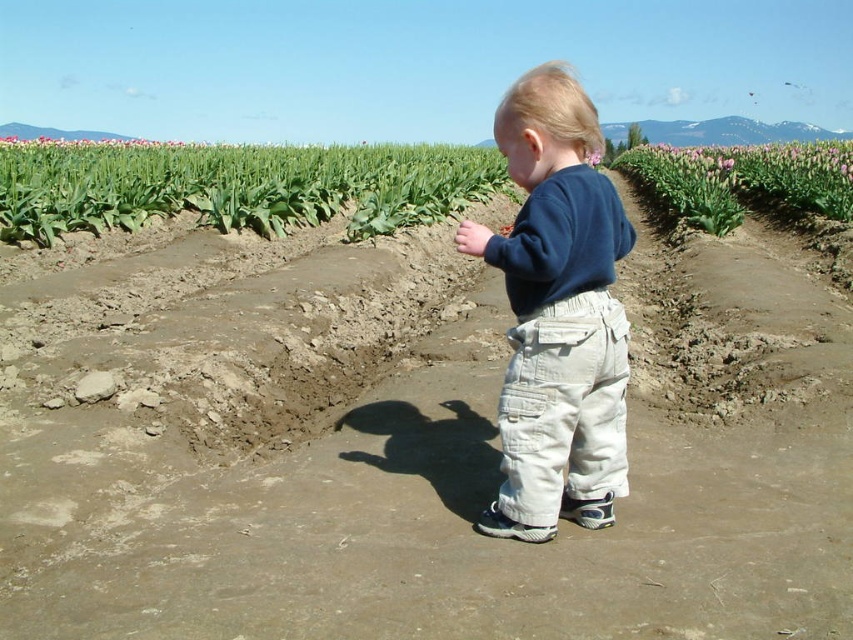
Question: Can you confirm if brown muddy path at center is positioned above pink tulip field at right?

Choices:
 (A) no
 (B) yes

Answer: (A)

Question: Where is green leafy corn field at upper left located in relation to pink tulip field at right in the image?

Choices:
 (A) right
 (B) left

Answer: (B)

Question: Estimate the real-world distances between objects in this image. Which object is farther from the pink tulip field at right?

Choices:
 (A) brown muddy path at center
 (B) dark blue cotton shirt at center
 (C) green leafy corn field at upper left

Answer: (A)

Question: Which point is farther from the camera taking this photo?

Choices:
 (A) (679, 497)
 (B) (482, 234)
 (C) (123, 204)
 (D) (722, 157)

Answer: (D)

Question: Does brown muddy path at center have a larger size compared to pink tulip field at right?

Choices:
 (A) no
 (B) yes

Answer: (A)

Question: Which point is farther from the camera taking this photo?

Choices:
 (A) (393, 440)
 (B) (405, 193)

Answer: (B)